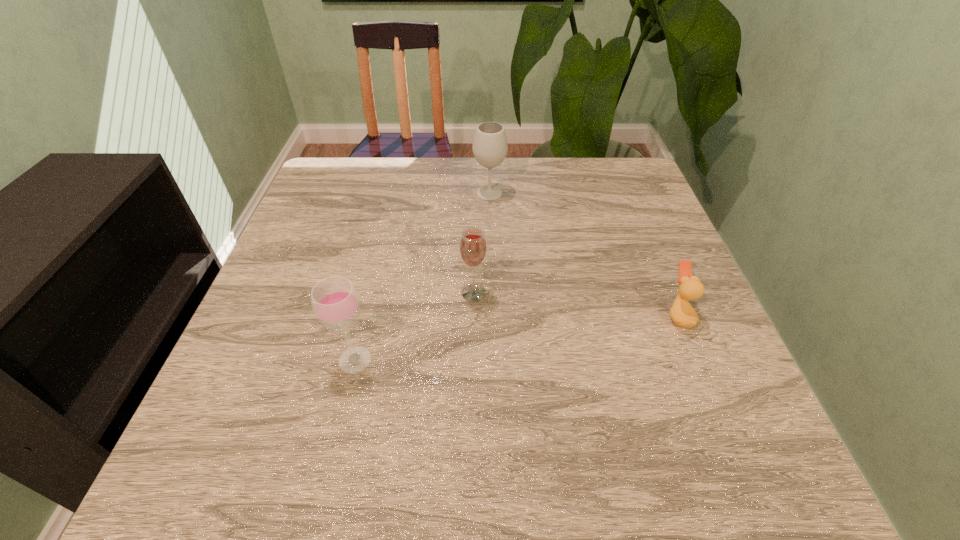
This screenshot has height=540, width=960. What are the coordinates of `object that is the third closest to the second nearest wineglass` in the screenshot? It's located at (682, 313).

Image resolution: width=960 pixels, height=540 pixels. I want to click on wineglass that stands as the second closest to the nearest object, so tap(490, 147).

Locate an element on the screen. The height and width of the screenshot is (540, 960). wineglass identified as the second closest to the leftmost wineglass is located at coordinates (490, 147).

This screenshot has width=960, height=540. Identify the location of vacant space that satisfies the following two spatial constraints: 1. on the back side of the second farthest wineglass; 2. on the left side of the leftmost object. (371, 293).

The width and height of the screenshot is (960, 540). In order to click on free space that satisfies the following two spatial constraints: 1. on the back side of the second nearest wineglass; 2. on the left side of the farthest object in this screenshot , I will do `click(475, 193)`.

The image size is (960, 540). Identify the location of vacant space that satisfies the following two spatial constraints: 1. on the back side of the farthest wineglass; 2. on the left side of the leftmost object. (395, 193).